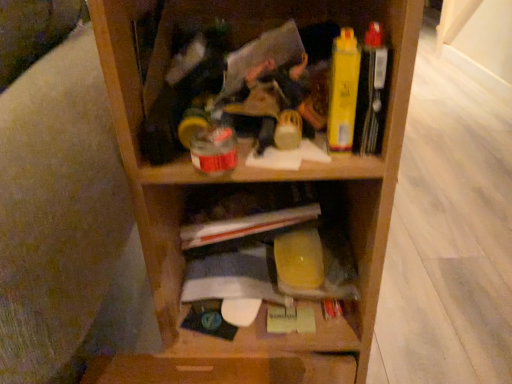
Question: Is yellow plastic container at center next to wooden shelf at center?

Choices:
 (A) yes
 (B) no

Answer: (A)

Question: Does yellow plastic container at center have a greater height compared to wooden shelf at center?

Choices:
 (A) yes
 (B) no

Answer: (B)

Question: Is wooden shelf at center a part of yellow plastic container at center?

Choices:
 (A) no
 (B) yes

Answer: (A)

Question: Is yellow plastic container at center wider than wooden shelf at center?

Choices:
 (A) no
 (B) yes

Answer: (A)

Question: Is yellow plastic container at center thinner than wooden shelf at center?

Choices:
 (A) no
 (B) yes

Answer: (B)

Question: Is yellow plastic container at center closer to the viewer compared to wooden shelf at center?

Choices:
 (A) yes
 (B) no

Answer: (B)

Question: Is wooden shelf at center further to camera compared to yellow plastic container at center?

Choices:
 (A) yes
 (B) no

Answer: (B)

Question: Does wooden shelf at center touch yellow plastic container at center?

Choices:
 (A) no
 (B) yes

Answer: (B)

Question: Considering the relative sizes of wooden shelf at center and yellow plastic container at center in the image provided, is wooden shelf at center shorter than yellow plastic container at center?

Choices:
 (A) yes
 (B) no

Answer: (B)

Question: From the image's perspective, is wooden shelf at center above yellow plastic container at center?

Choices:
 (A) no
 (B) yes

Answer: (B)

Question: Can you confirm if wooden shelf at center is positioned to the right of yellow plastic container at center?

Choices:
 (A) yes
 (B) no

Answer: (A)

Question: From a real-world perspective, is wooden shelf at center under yellow plastic container at center?

Choices:
 (A) no
 (B) yes

Answer: (A)

Question: Is yellow plastic container at center closer to camera compared to yellow matte book at upper right?

Choices:
 (A) yes
 (B) no

Answer: (B)